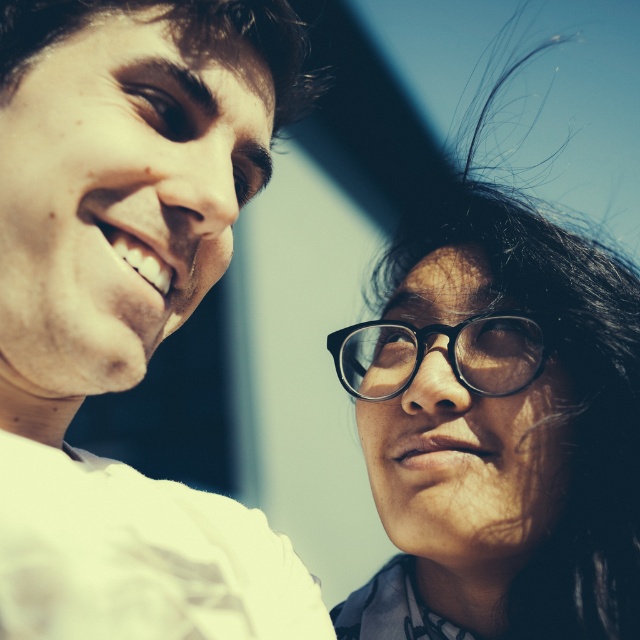
Is point (113, 243) behind point (568, 388)?

No, (113, 243) is in front of (568, 388).

Can you confirm if matte white shirt at left is shorter than black plastic glasses at right?

Yes.

Where is `matte white shirt at left`? Image resolution: width=640 pixels, height=640 pixels. matte white shirt at left is located at coordinates (125, 310).

Who is more distant from viewer, (404,477) or (348,333)?

Point (348,333)

In order to click on black plastic glasses at right in this screenshot , I will do `click(499, 428)`.

Which is behind, point (282, 81) or point (392, 332)?

Positioned behind is point (392, 332).

In order to click on matte white shirt at left in this screenshot , I will do `click(125, 310)`.

At what (x,y) coordinates should I click in order to perform the action: click on matte white shirt at left. Please return your answer as a coordinate pair (x, y). Looking at the image, I should click on (125, 310).